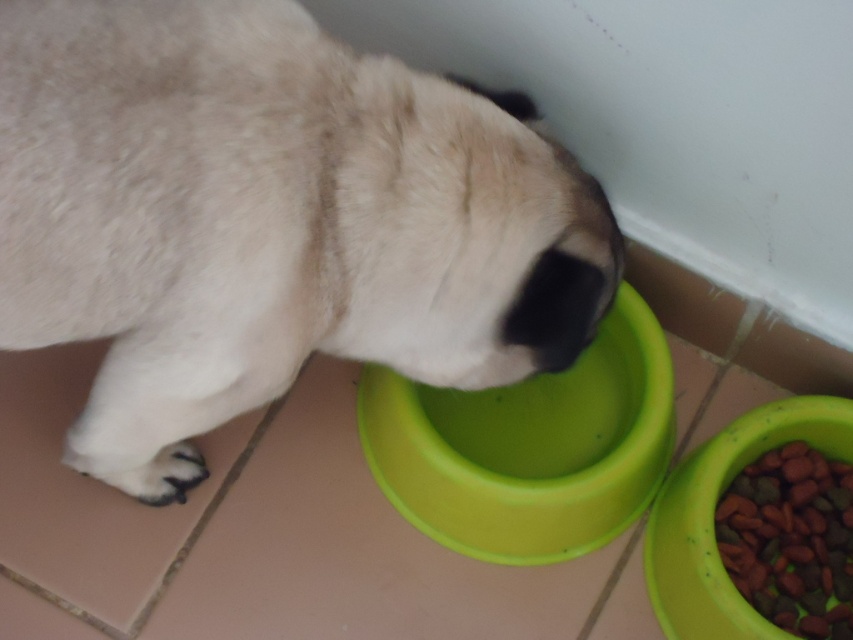
You are a dog owner trying to place a new toy in the image. The toy must be placed at point (529, 445). Will the toy overlap with the green plastic bowl at center?

Yes, the toy will overlap with the green plastic bowl at center because point (529, 445) is on the green plastic bowl at center.

You are a small dog with a 12 inch long body. You are currently at the green plastic bowl at center and want to reach the brown crunchy kibble at lower right. Can you reach it without moving your body?

The green plastic bowl at center and brown crunchy kibble at lower right are 10.77 inches apart from each other. Since the distance between them is less than your body length of 12 inches, you can reach the brown crunchy kibble at lower right without moving your body.